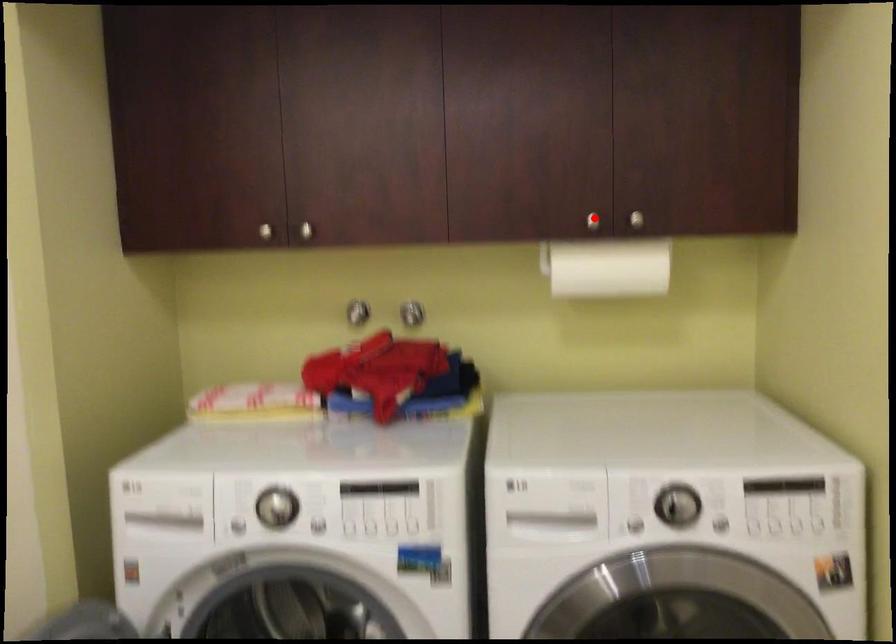
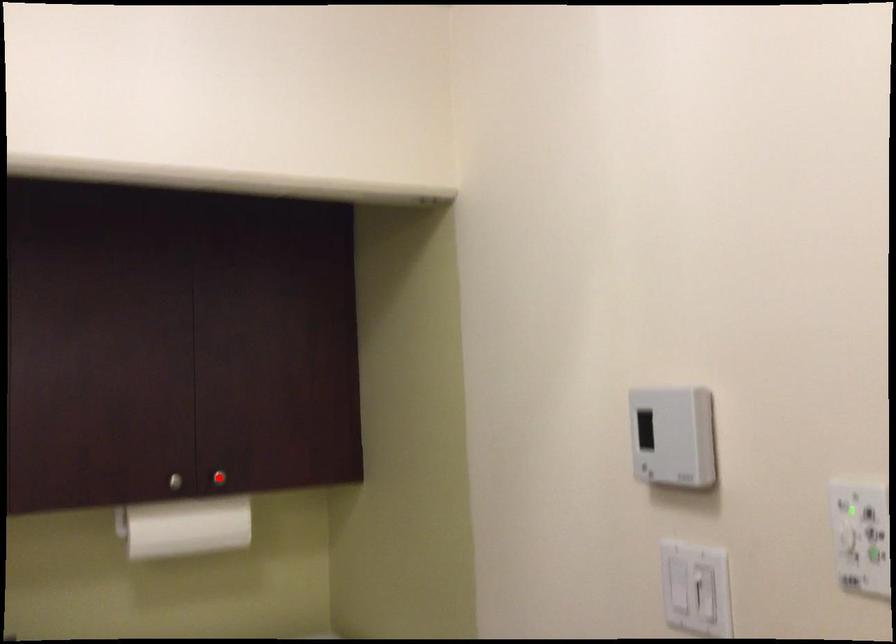
I am providing you with two images of the same scene from different viewpoints. A red point is marked on the first image and another point is marked on the second image. Are the points marked in image1 and image2 representing the same 3D position?

No